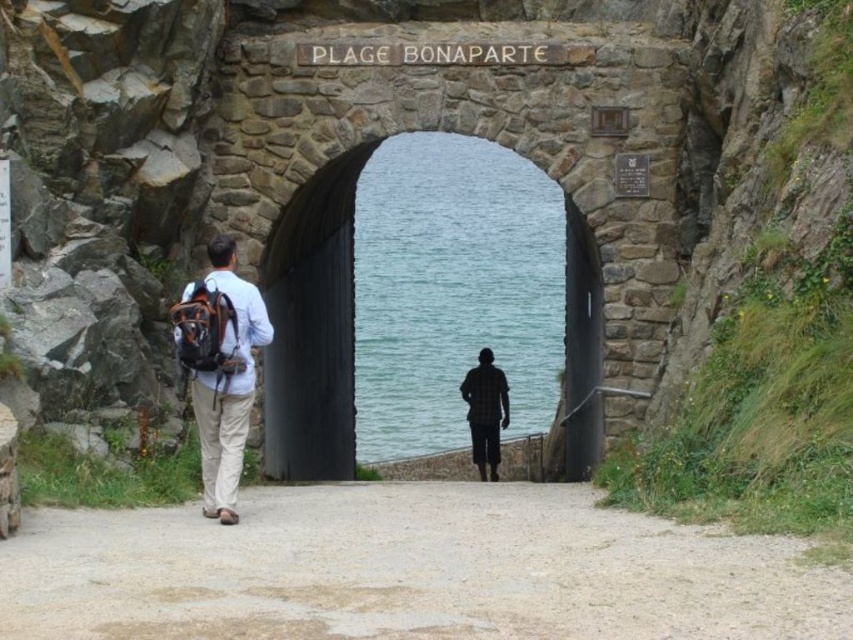
In the scene shown: Is clear blue water at center closer to camera compared to matte black backpack at left?

No, clear blue water at center is further to the viewer.

Can you confirm if clear blue water at center is smaller than matte black backpack at left?

No, clear blue water at center is not smaller than matte black backpack at left.

Where is `clear blue water at center`? clear blue water at center is located at coordinates (451, 289).

Between dirt/gravel path at center and matte black backpack at left, which one has more height?

Standing taller between the two is matte black backpack at left.

Looking at this image, between dirt/gravel path at center and matte black backpack at left, which one has less height?

dirt/gravel path at center is shorter.

This screenshot has width=853, height=640. I want to click on dirt/gravel path at center, so click(409, 570).

Does dirt/gravel path at center have a larger size compared to clear blue water at center?

No.

Is dirt/gravel path at center shorter than clear blue water at center?

Correct, dirt/gravel path at center is not as tall as clear blue water at center.

Where is `dirt/gravel path at center`? The width and height of the screenshot is (853, 640). dirt/gravel path at center is located at coordinates (409, 570).

Where is `dirt/gravel path at center`? The image size is (853, 640). dirt/gravel path at center is located at coordinates (409, 570).